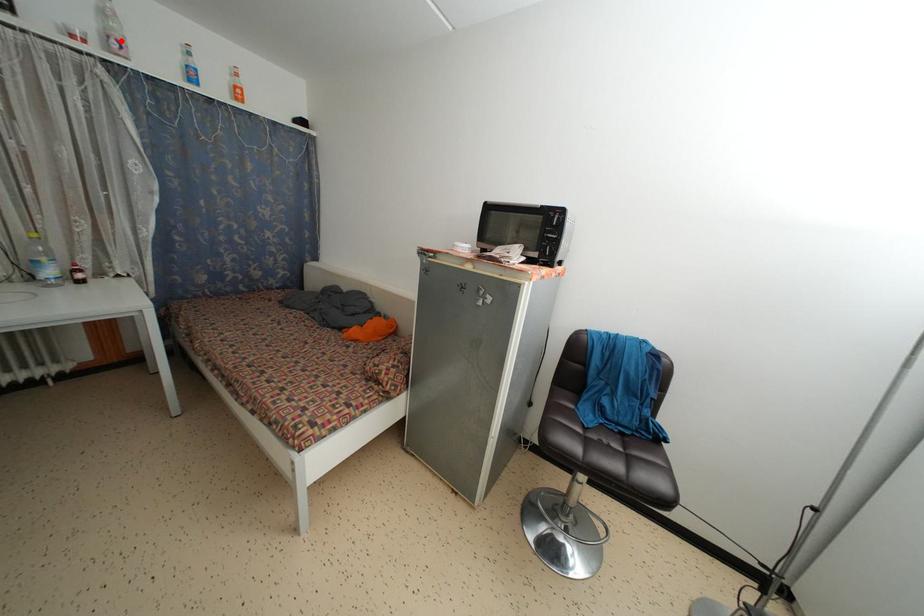
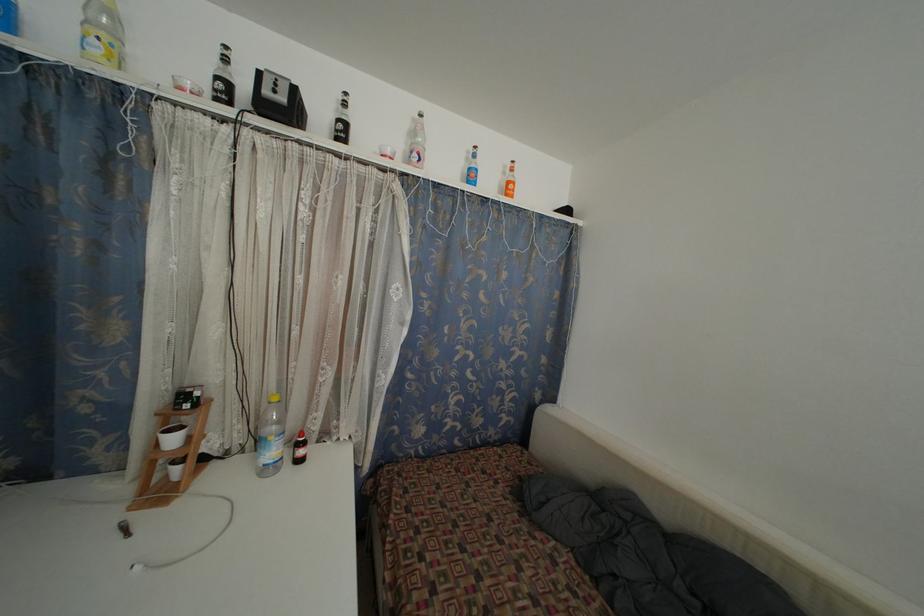
Find the pixel in the second image that matches the highlighted location in the first image.

(423, 154)